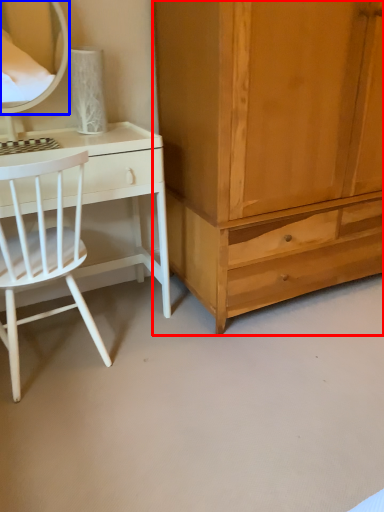
Question: Which of the following is the closest to the observer, cabinetry (highlighted by a red box) or mirror (highlighted by a blue box)?

Choices:
 (A) cabinetry
 (B) mirror

Answer: (A)